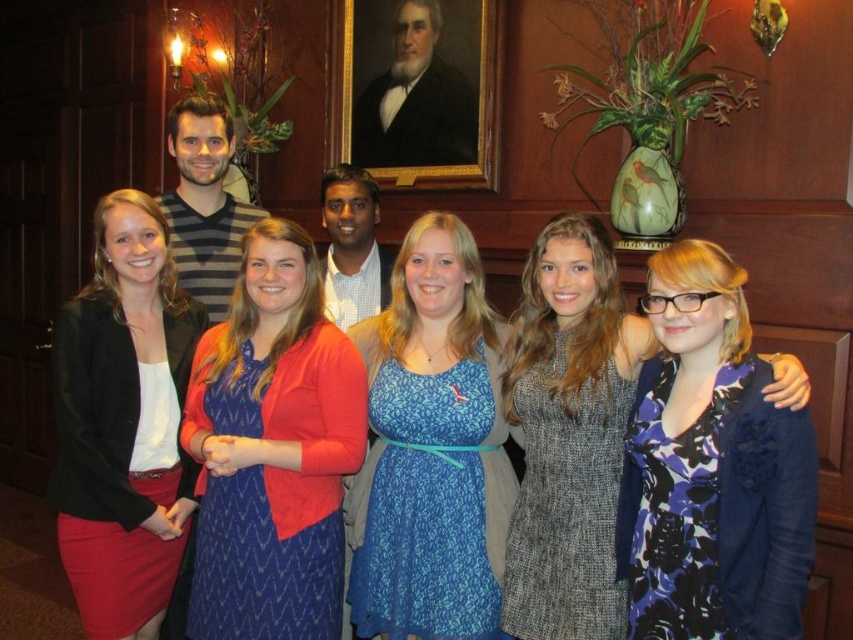
You are organizing a photo shoot and need to arrange the participants in the same order as the original image. If you start from the left side of the image, which item comes first between the blue textured dress at center and the matte black blazer at left?

The matte black blazer at left comes first when starting from the left side of the image, as the blue textured dress at center is positioned to its right.

You are standing in the room and want to find the blue textured dress at center. According to the coordinates provided, where should you look relative to the other objects in the scene?

The blue textured dress at center is located at point 0.703 on the x axis and 0.320 on the y axis. Since there are no other coordinates provided for comparison, you should look towards the center of the image where the dress is positioned.